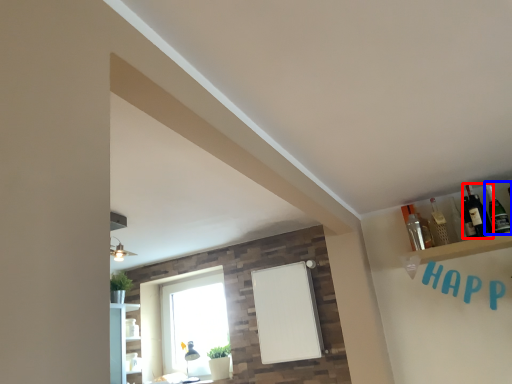
Question: Which object is further to the camera taking this photo, bottle (highlighted by a red box) or bottle (highlighted by a blue box)?

Choices:
 (A) bottle
 (B) bottle

Answer: (A)